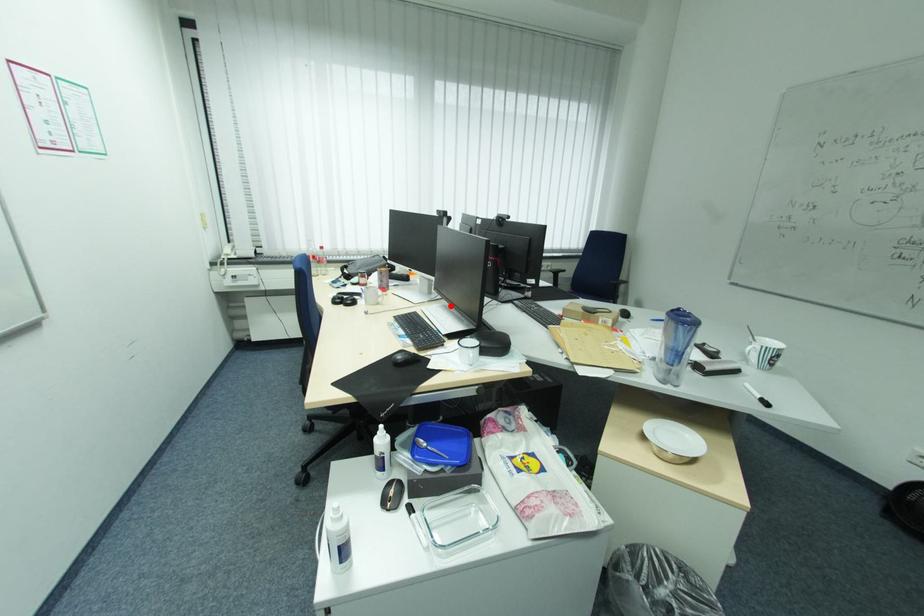
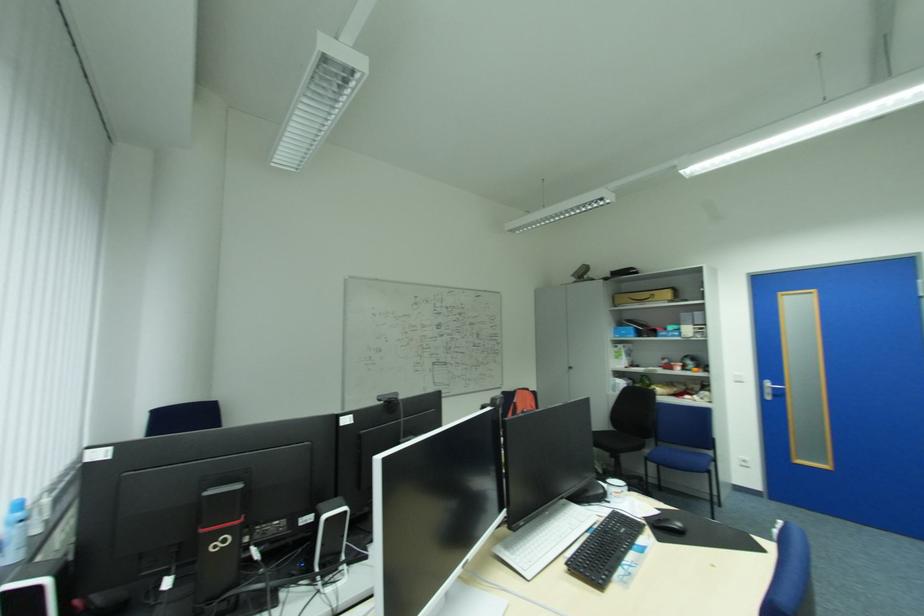
The point at the highlighted location is marked in the first image. Where is the corresponding point in the second image?

(514, 546)